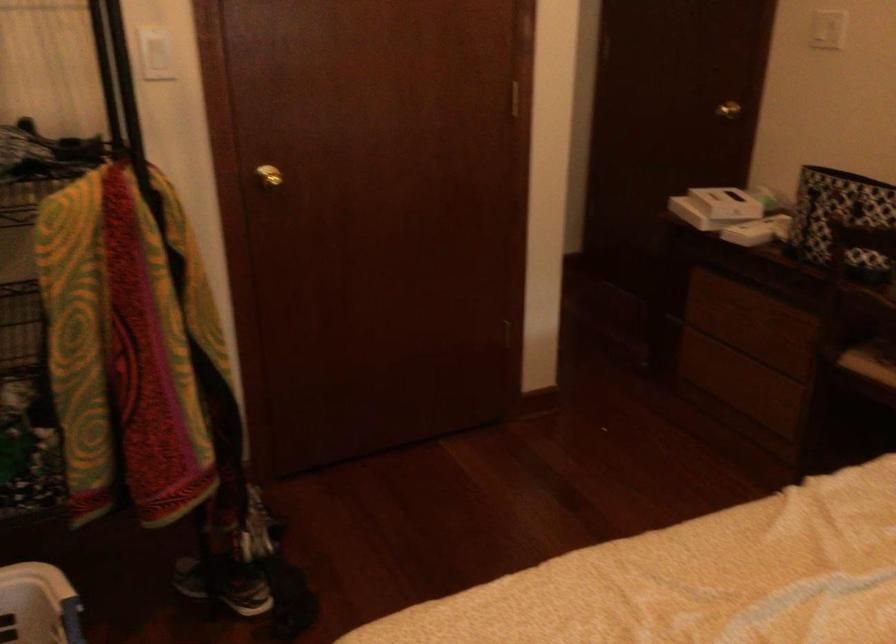
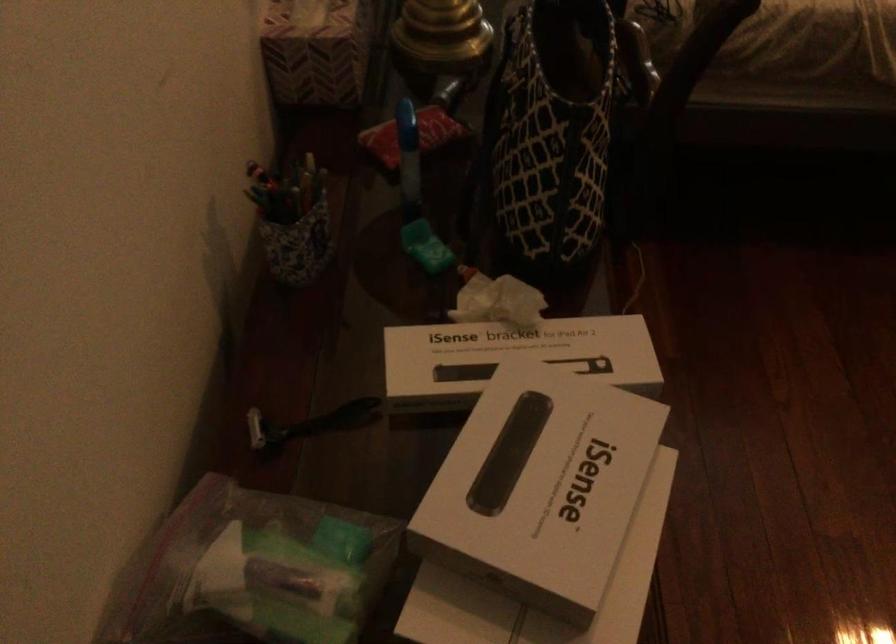
Find the pixel in the second image that matches the point at 704,190 in the first image.

(540, 486)